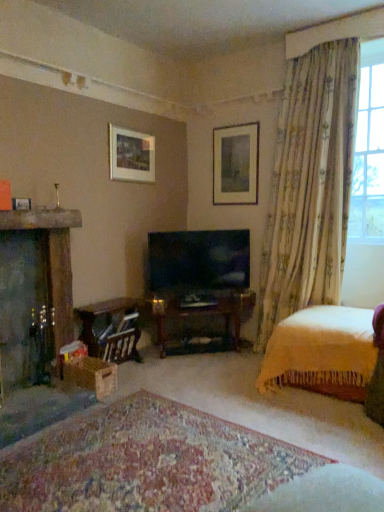
Measure the distance between point (283, 364) and camera.

Point (283, 364) is 9.55 feet from camera.

Describe the element at coordinates (369, 150) in the screenshot. I see `translucent floral curtains at right` at that location.

Measure the distance between point [377,153] and camera.

Point [377,153] and camera are 3.29 meters apart from each other.

This screenshot has width=384, height=512. What do you see at coordinates (102, 321) in the screenshot?
I see `wooden table at lower left` at bounding box center [102, 321].

Describe the element at coordinates (131, 155) in the screenshot. The height and width of the screenshot is (512, 384). I see `matte white picture frame at upper center, which is the second picture frame from left to right` at that location.

What is the approximate width of matte white picture frame at upper center, the 2th picture frame when ordered from back to front?

matte white picture frame at upper center, the 2th picture frame when ordered from back to front, is 1.96 inches in width.

What is the approximate width of matte white picture frame at upper left, arranged as the third picture frame when viewed from the right?

3.11 inches.

At what (x,y) coordinates should I click in order to perform the action: click on matte white picture frame at upper left, arranged as the third picture frame when viewed from the right. Please return your answer as a coordinate pair (x, y). Looking at the image, I should click on (21, 204).

Find the location of a particular element. This screenshot has width=384, height=512. carpeted rug at center is located at coordinates (145, 462).

From a real-world perspective, is matte black tv at center physically above matte white picture frame at upper left, the 3th picture frame positioned from the back?

Actually, matte black tv at center is physically below matte white picture frame at upper left, the 3th picture frame positioned from the back, in the real world.

Which is in front, point (205, 286) or point (30, 203)?

The point (30, 203) is closer.

Is matte black tv at center in front of or behind matte white picture frame at upper left, the 1th picture frame viewed from the front, in the image?

In the image, matte black tv at center appears behind matte white picture frame at upper left, the 1th picture frame viewed from the front.

Is matte black tv at center inside or outside of matte white picture frame at upper left, arranged as the third picture frame when viewed from the right?

matte black tv at center is located beyond the bounds of matte white picture frame at upper left, arranged as the third picture frame when viewed from the right.

From the image's perspective, is carpeted rug at center on matte black tv at center?

Actually, carpeted rug at center appears below matte black tv at center in the image.

Based on their positions, is carpeted rug at center located to the left or right of matte black tv at center?

In the image, carpeted rug at center appears on the left side of matte black tv at center.

From a real-world perspective, between carpeted rug at center and matte black tv at center, who is vertically lower?

carpeted rug at center.

Could you tell me if wooden table at lower left is facing matte white picture frame at upper left, the 1th picture frame from the left?

No, wooden table at lower left is not oriented towards matte white picture frame at upper left, the 1th picture frame from the left.

Is point (121, 345) closer or farther from the camera than point (18, 208)?

Point (121, 345) is positioned farther from the camera compared to point (18, 208).

The image size is (384, 512). Identify the location of table located behind the matte white picture frame at upper left, arranged as the third picture frame when viewed from the right. (102, 321).

Could you measure the distance between wooden table at lower left and matte white picture frame at upper left, the 1th picture frame from the left?

wooden table at lower left is 1.09 meters away from matte white picture frame at upper left, the 1th picture frame from the left.

From a real-world perspective, is matte white picture frame at upper left, the 1th picture frame viewed from the front, above or below floral fabric curtain at upper right?

matte white picture frame at upper left, the 1th picture frame viewed from the front, is situated lower than floral fabric curtain at upper right in the real world.

Is matte white picture frame at upper left, the 3th picture frame positioned from the back, taller than floral fabric curtain at upper right?

In fact, matte white picture frame at upper left, the 3th picture frame positioned from the back, may be shorter than floral fabric curtain at upper right.

From the image's perspective, is matte white picture frame at upper left, the 3th picture frame positioned from the back, above or below floral fabric curtain at upper right?

Clearly, from the image's perspective, matte white picture frame at upper left, the 3th picture frame positioned from the back, is below floral fabric curtain at upper right.

Is matte white picture frame at upper left, arranged as the third picture frame when viewed from the right, directly adjacent to floral fabric curtain at upper right?

No, matte white picture frame at upper left, arranged as the third picture frame when viewed from the right, is not next to floral fabric curtain at upper right.

Is matte white picture frame at upper left, the 3th picture frame positioned from the back, positioned beyond the bounds of matte black tv at center?

Yes.

Is matte white picture frame at upper left, the 1th picture frame from the left, taller than matte black tv at center?

In fact, matte white picture frame at upper left, the 1th picture frame from the left, may be shorter than matte black tv at center.

Find the location of `the 2nd picture frame counting from the left of the matte black tv at center`. the 2nd picture frame counting from the left of the matte black tv at center is located at coordinates (21, 204).

Which object is wider, matte white picture frame at upper left, arranged as the third picture frame when viewed from the right, or matte black tv at center?

matte black tv at center.

Is carpeted rug at center turned away from translucent floral curtains at right?

No, carpeted rug at center is not facing away from translucent floral curtains at right.

From the picture: Is carpeted rug at center bigger than translucent floral curtains at right?

No.

Would you say carpeted rug at center is a long distance from translucent floral curtains at right?

Indeed, carpeted rug at center is not near translucent floral curtains at right.

Which object is wider, floral fabric curtain at upper right or yellow knitted blanket at lower right?

Wider between the two is yellow knitted blanket at lower right.

Is floral fabric curtain at upper right aimed at yellow knitted blanket at lower right?

Yes, floral fabric curtain at upper right is aimed at yellow knitted blanket at lower right.

Considering the positions of point (302, 166) and point (314, 310), is point (302, 166) closer or farther from the camera than point (314, 310)?

Point (302, 166) is positioned farther from the camera compared to point (314, 310).

Find the location of a particular element. television on the right of matte white picture frame at upper left, the 1th picture frame viewed from the front is located at coordinates (198, 260).

At what (x,y) coordinates should I click in order to perform the action: click on plain below the matte black tv at center (from the image's perspective). Please return your answer as a coordinate pair (x, y). The height and width of the screenshot is (512, 384). Looking at the image, I should click on (145, 462).

Considering their positions, is floral fabric curtain at upper right positioned closer to matte white picture frame at upper left, the 1th picture frame viewed from the front, than matte white picture frame at upper center, the 1th picture frame positioned from the right?

matte white picture frame at upper center, the 1th picture frame positioned from the right, lies closer to matte white picture frame at upper left, the 1th picture frame viewed from the front, than the other object.

Considering their positions, is translucent floral curtains at right positioned closer to carpeted rug at center than matte white picture frame at upper center, acting as the second picture frame starting from the right?

Among the two, matte white picture frame at upper center, acting as the second picture frame starting from the right, is located nearer to carpeted rug at center.

When comparing their distances from wooden table at lower left, does floral fabric curtain at upper right or matte white picture frame at upper left, the 3th picture frame positioned from the back, seem further?

floral fabric curtain at upper right is further to wooden table at lower left.

From the picture: Which object lies further to the anchor point matte white picture frame at upper left, the 1th picture frame viewed from the front, wooden table at lower left or carpeted rug at center?

carpeted rug at center lies further to matte white picture frame at upper left, the 1th picture frame viewed from the front, than the other object.

From the image, which object appears to be nearer to carpeted rug at center, floral fabric curtain at upper right or translucent floral curtains at right?

Based on the image, floral fabric curtain at upper right appears to be nearer to carpeted rug at center.

Estimate the real-world distances between objects in this image. Which object is closer to dark gray stone fireplace at left, carpeted rug at center or translucent floral curtains at right?

The object closer to dark gray stone fireplace at left is carpeted rug at center.

From the image, which object appears to be farther from wooden table at lower left, floral fabric curtain at upper right or yellow knitted blanket at lower right?

floral fabric curtain at upper right lies further to wooden table at lower left than the other object.

Consider the image. Which object lies further to the anchor point matte black tv at center, matte white picture frame at upper center, which is the second picture frame from left to right, or carpeted rug at center?

Based on the image, carpeted rug at center appears to be further to matte black tv at center.

At what (x,y) coordinates should I click in order to perform the action: click on television located between matte white picture frame at upper left, the 3th picture frame positioned from the back, and translucent floral curtains at right in the left-right direction. Please return your answer as a coordinate pair (x, y). Image resolution: width=384 pixels, height=512 pixels. Looking at the image, I should click on (198, 260).

Find the location of a particular element. Image resolution: width=384 pixels, height=512 pixels. fireplace positioned between carpeted rug at center and matte black tv at center from near to far is located at coordinates (34, 290).

This screenshot has height=512, width=384. What are the coordinates of `curtain situated between matte white picture frame at upper center, acting as the second picture frame starting from the right, and yellow knitted blanket at lower right from left to right` in the screenshot? It's located at (310, 185).

Identify the location of television that lies between translucent floral curtains at right and yellow knitted blanket at lower right from top to bottom. Image resolution: width=384 pixels, height=512 pixels. (198, 260).